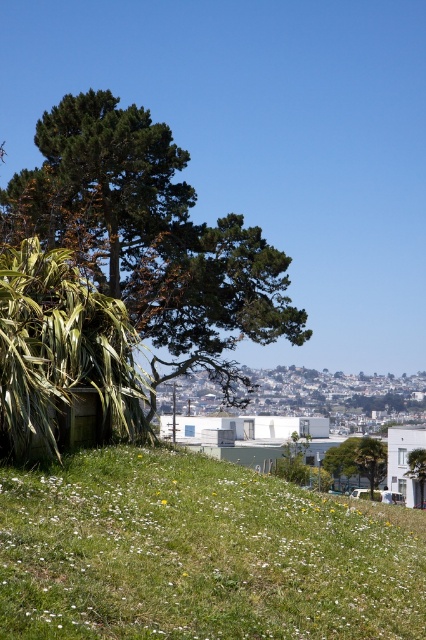
Question: Which of these objects is positioned closest to the green leafy tree at upper left?

Choices:
 (A) green grassy hillside at lower left
 (B) green leafy tree at center

Answer: (A)

Question: Among these points, which one is nearest to the camera?

Choices:
 (A) [198, 492]
 (B) [385, 476]

Answer: (A)

Question: Which object appears farthest from the camera in this image?

Choices:
 (A) green grassy hillside at lower left
 (B) green leafy tree at center
 (C) green leafy tree at upper left

Answer: (B)

Question: Does green grassy hillside at lower left come in front of green leafy tree at center?

Choices:
 (A) no
 (B) yes

Answer: (B)

Question: Is green grassy hillside at lower left positioned behind green leafy tree at upper left?

Choices:
 (A) no
 (B) yes

Answer: (A)

Question: In this image, where is green grassy hillside at lower left located relative to green leafy tree at center?

Choices:
 (A) left
 (B) right

Answer: (A)